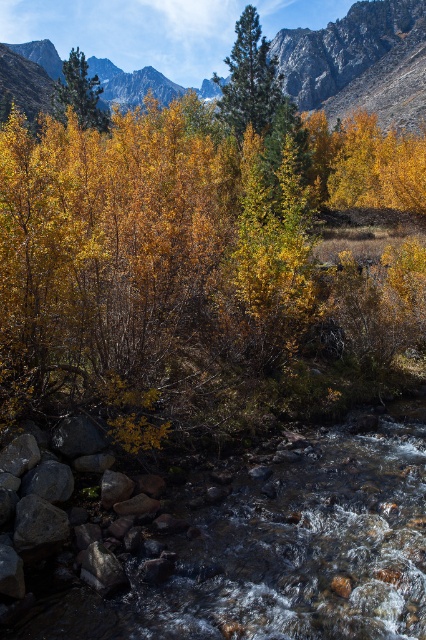
Question: Among these points, which one is farthest from the camera?

Choices:
 (A) pyautogui.click(x=89, y=81)
 (B) pyautogui.click(x=109, y=392)

Answer: (A)

Question: In this image, where is yellow-green leaves at center located relative to green matte tree at center?

Choices:
 (A) above
 (B) below

Answer: (B)

Question: Does rugged granite mountain at upper center have a smaller size compared to green matte tree at center?

Choices:
 (A) yes
 (B) no

Answer: (B)

Question: Which point is closer to the camera taking this photo?

Choices:
 (A) (106, 92)
 (B) (187, 304)
 (C) (77, 112)
 (D) (241, 70)

Answer: (B)

Question: Can you confirm if yellow-green leaves at center is bigger than rugged granite mountain at upper center?

Choices:
 (A) no
 (B) yes

Answer: (A)

Question: Among these points, which one is farthest from the camera?

Choices:
 (A) (106, 118)
 (B) (299, 36)
 (C) (245, 116)
 (D) (11, 116)

Answer: (B)